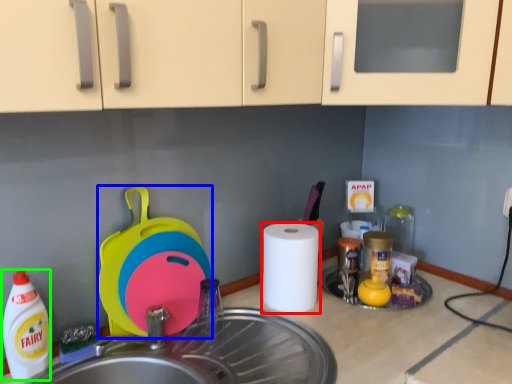
Question: Estimate the real-world distances between objects in this image. Which object is closer to paper towel (highlighted by a red box), appliance (highlighted by a blue box) or cleaning product (highlighted by a green box)?

Choices:
 (A) appliance
 (B) cleaning product

Answer: (A)